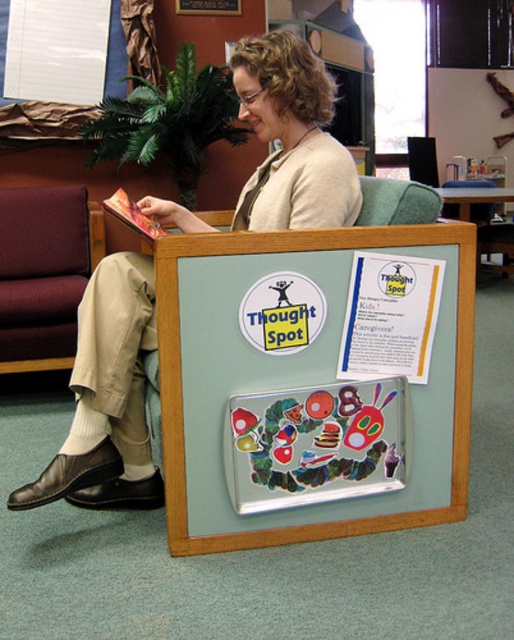
Question: Is light beige sweater at center thinner than metallic silver tray at center?

Choices:
 (A) yes
 (B) no

Answer: (B)

Question: Is light beige sweater at center above hardcover book at center?

Choices:
 (A) no
 (B) yes

Answer: (A)

Question: Does metallic silver tray at center have a greater width compared to hardcover book at center?

Choices:
 (A) no
 (B) yes

Answer: (B)

Question: Which point is closer to the camera?

Choices:
 (A) hardcover book at center
 (B) metallic silver tray at center

Answer: (A)

Question: Which of the following is the farthest from the observer?

Choices:
 (A) metallic silver tray at center
 (B) maroon fabric armchair at left
 (C) hardcover book at center

Answer: (B)

Question: Which point is farther to the camera?

Choices:
 (A) light beige sweater at center
 (B) metallic silver tray at center
 (C) maroon fabric armchair at left
 (D) hardcover book at center

Answer: (C)